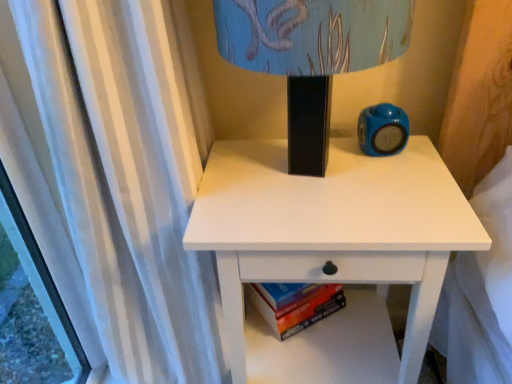
Find the location of a particular element. The image size is (512, 384). free space to the right of matte plastic alarm clock at upper right is located at coordinates (423, 157).